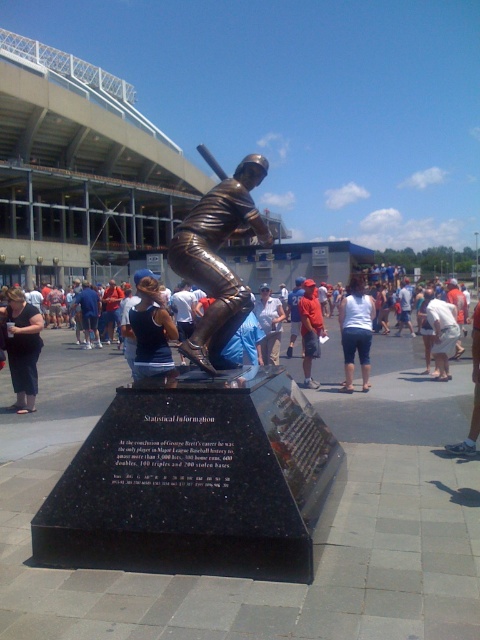
Question: Does dark blue tank top at center appear on the left side of orange shirt at center?

Choices:
 (A) yes
 (B) no

Answer: (A)

Question: Which is nearer to the white cotton shirt at center?

Choices:
 (A) denim shorts at center
 (B) dark gray pants at lower left

Answer: (B)

Question: Is dark blue tank top at center to the right of orange shirt at center from the viewer's perspective?

Choices:
 (A) yes
 (B) no

Answer: (B)

Question: Which point is closer to the camera?

Choices:
 (A) (90, 340)
 (B) (351, 292)

Answer: (B)

Question: Does white cotton tank top at center appear on the right side of white fabric shirt at center?

Choices:
 (A) yes
 (B) no

Answer: (A)

Question: Which is farther from the white cotton tank top at center?

Choices:
 (A) orange shirt at center
 (B) white cotton shirt at center
 (C) white fabric shirt at center

Answer: (C)